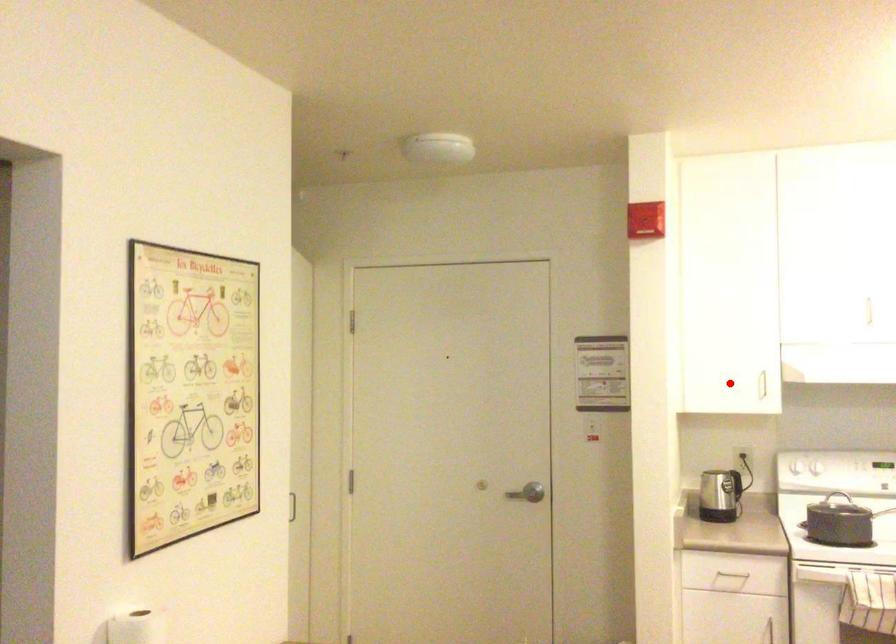
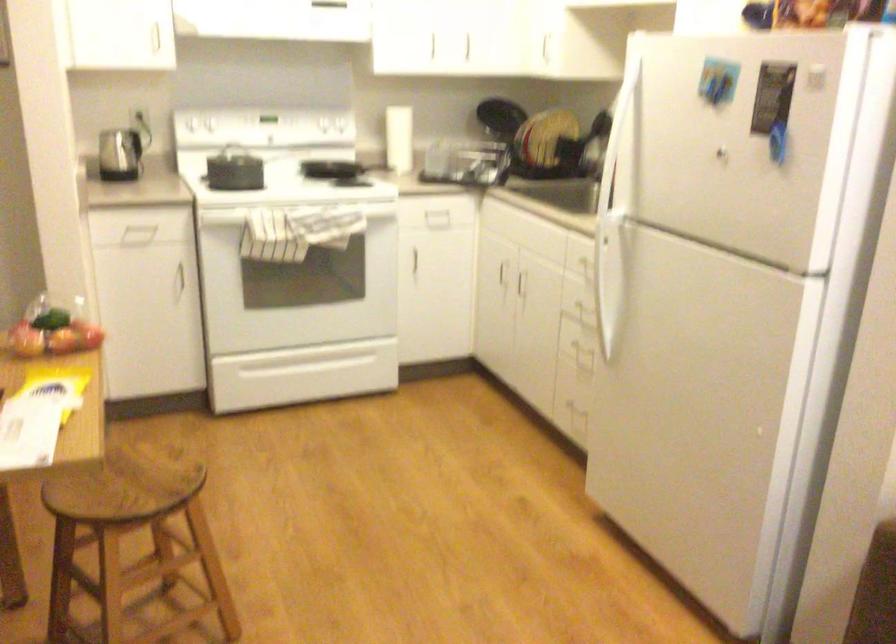
Locate, in the second image, the point that corresponds to the highlighted location in the first image.

(119, 35)